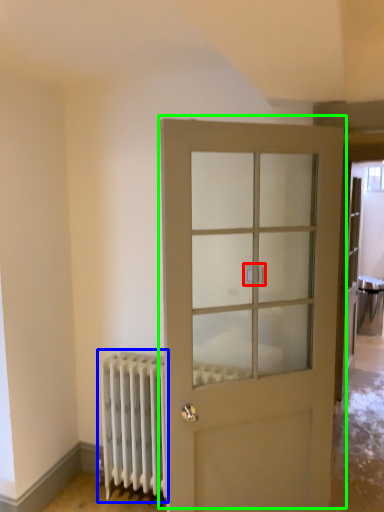
Question: Which is farther away from door handle (highlighted by a red box)? radiator (highlighted by a blue box) or door (highlighted by a green box)?

Choices:
 (A) radiator
 (B) door

Answer: (A)